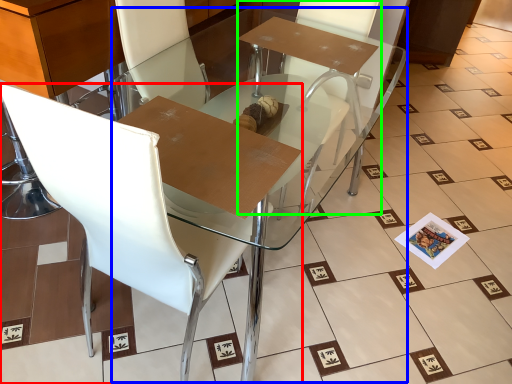
Question: Based on their relative distances, which object is farther from chair (highlighted by a red box)? Choose from round table (highlighted by a blue box) and armchair (highlighted by a green box).

Choices:
 (A) round table
 (B) armchair

Answer: (B)